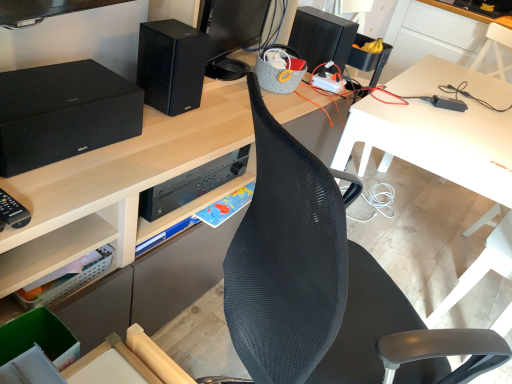
Question: Is the position of white plastic table at upper right, which is the first table from back to front, less distant than that of clear plastic basket at lower left?

Choices:
 (A) yes
 (B) no

Answer: (B)

Question: Does white plastic table at upper right, which is counted as the 2th table, starting from the front, have a greater width compared to clear plastic basket at lower left?

Choices:
 (A) no
 (B) yes

Answer: (B)

Question: Is white plastic table at upper right, the 2th table positioned from the bottom, positioned with its back to clear plastic basket at lower left?

Choices:
 (A) no
 (B) yes

Answer: (A)

Question: Is white plastic table at upper right, which is the first table from back to front, far away from clear plastic basket at lower left?

Choices:
 (A) yes
 (B) no

Answer: (A)

Question: Considering the relative positions of white plastic table at upper right, which is counted as the 2th table, starting from the front, and clear plastic basket at lower left in the image provided, is white plastic table at upper right, which is counted as the 2th table, starting from the front, to the left of clear plastic basket at lower left from the viewer's perspective?

Choices:
 (A) no
 (B) yes

Answer: (A)

Question: From the image's perspective, is white plastic table at center, the second table from the top, located above or below matte black speaker at left, which appears as the third speaker when viewed from the right?

Choices:
 (A) above
 (B) below

Answer: (B)

Question: Relative to matte black speaker at left, which appears as the third speaker when viewed from the right, is white plastic table at center, positioned as the first table in front-to-back order, in front or behind?

Choices:
 (A) front
 (B) behind

Answer: (B)

Question: In terms of width, does white plastic table at center, positioned as the first table in front-to-back order, look wider or thinner when compared to matte black speaker at left, positioned as the 1th speaker in left-to-right order?

Choices:
 (A) wide
 (B) thin

Answer: (A)

Question: Is white plastic table at center, which ranks as the 1th table in bottom-to-top order, taller or shorter than matte black speaker at left, positioned as the 1th speaker in left-to-right order?

Choices:
 (A) tall
 (B) short

Answer: (A)

Question: Looking at their shapes, would you say matte black speaker at left, arranged as the 3th speaker when viewed from the back, is wider or thinner than white plastic table at center, which ranks as the 1th table in bottom-to-top order?

Choices:
 (A) thin
 (B) wide

Answer: (A)

Question: Considering the positions of matte black speaker at left, positioned as the 1th speaker in left-to-right order, and white plastic table at center, positioned as the first table in front-to-back order, in the image, is matte black speaker at left, positioned as the 1th speaker in left-to-right order, bigger or smaller than white plastic table at center, positioned as the first table in front-to-back order,?

Choices:
 (A) small
 (B) big

Answer: (A)

Question: Considering the relative positions of matte black speaker at left, arranged as the 3th speaker when viewed from the back, and white plastic table at center, the second table in the back-to-front sequence, in the image provided, is matte black speaker at left, arranged as the 3th speaker when viewed from the back, to the left or to the right of white plastic table at center, the second table in the back-to-front sequence,?

Choices:
 (A) left
 (B) right

Answer: (A)

Question: Considering the positions of matte black speaker at left, positioned as the 1th speaker in left-to-right order, and white plastic table at center, positioned as the first table in front-to-back order, in the image, is matte black speaker at left, positioned as the 1th speaker in left-to-right order, taller or shorter than white plastic table at center, positioned as the first table in front-to-back order,?

Choices:
 (A) tall
 (B) short

Answer: (B)

Question: Looking at their shapes, would you say black mesh chair at center is wider or thinner than black matte speaker at upper right, acting as the 3th speaker starting from the front?

Choices:
 (A) thin
 (B) wide

Answer: (B)

Question: Would you say black mesh chair at center is inside or outside black matte speaker at upper right, marked as the 1th speaker in a right-to-left arrangement?

Choices:
 (A) inside
 (B) outside

Answer: (B)